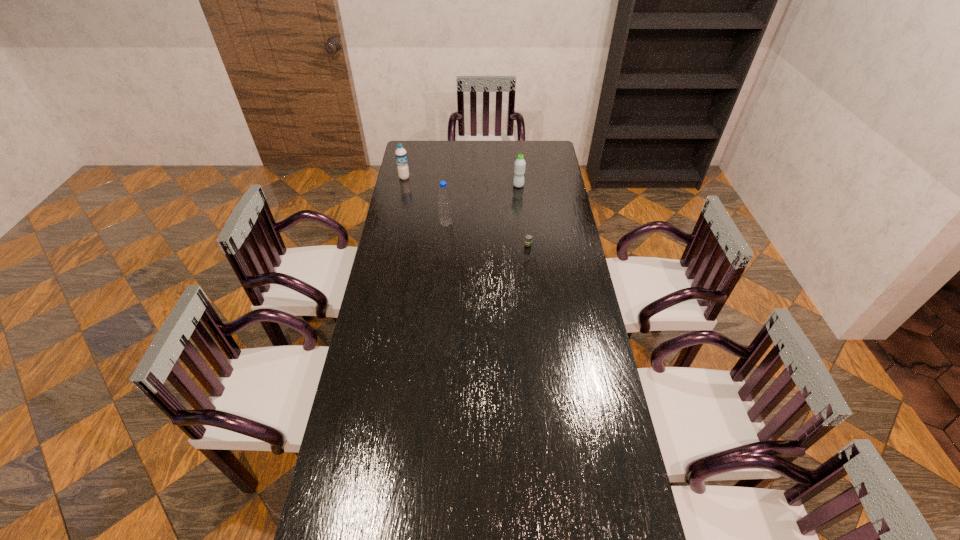
This screenshot has width=960, height=540. Identify the location of free space located 0.160m on the back of the second farthest water bottle. tap(516, 165).

You are a GUI agent. You are given a task and a screenshot of the screen. Output one action in this format:
    pyautogui.click(x=<x>, y=<y>)
    Task: Click on the vacant space located 0.340m on the back of the nearest object
    
    Given the screenshot: What is the action you would take?
    pyautogui.click(x=522, y=192)

Where is `object at the left edge`? The width and height of the screenshot is (960, 540). object at the left edge is located at coordinates (401, 156).

The width and height of the screenshot is (960, 540). In the image, there is a desktop. In order to click on free region at the far edge in this screenshot , I will do `click(482, 157)`.

In the image, there is a desktop. What are the coordinates of `blank space at the left edge` in the screenshot? It's located at (395, 245).

Locate an element on the screen. The height and width of the screenshot is (540, 960). free space at the right edge of the desktop is located at coordinates (574, 336).

Image resolution: width=960 pixels, height=540 pixels. In order to click on free space between the leftmost object and the second water bottle from right to left in this screenshot , I will do `click(425, 201)`.

Find the location of a particular element. Image resolution: width=960 pixels, height=540 pixels. free space between the beer can and the farthest object is located at coordinates (467, 211).

Find the location of a particular element. free spot between the farthest water bottle and the second nearest water bottle is located at coordinates (462, 181).

You are a GUI agent. You are given a task and a screenshot of the screen. Output one action in this format:
    pyautogui.click(x=<x>, y=<y>)
    Task: Click on the vacant area that lies between the leftmost water bottle and the second nearest water bottle
    This screenshot has width=960, height=540.
    Given the screenshot: What is the action you would take?
    pyautogui.click(x=462, y=181)